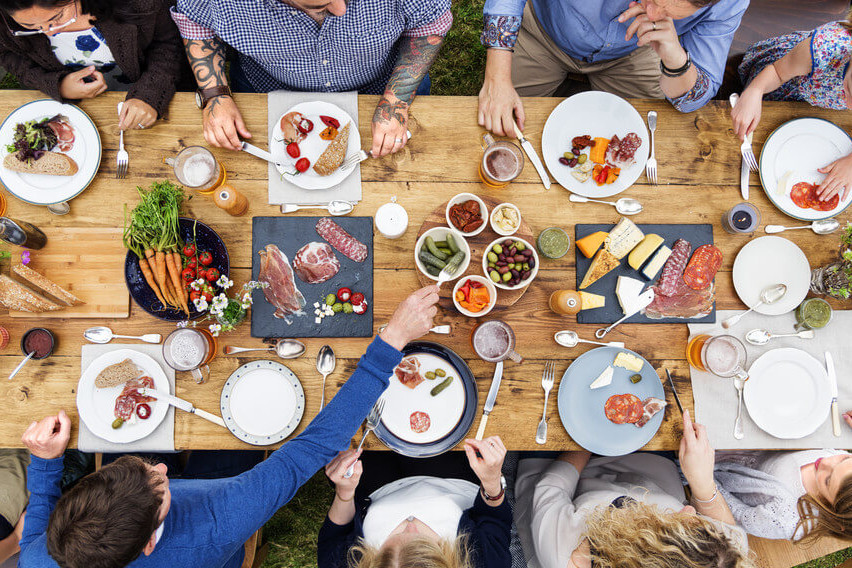
Identify the location of table. This screenshot has height=568, width=852. (108, 204).